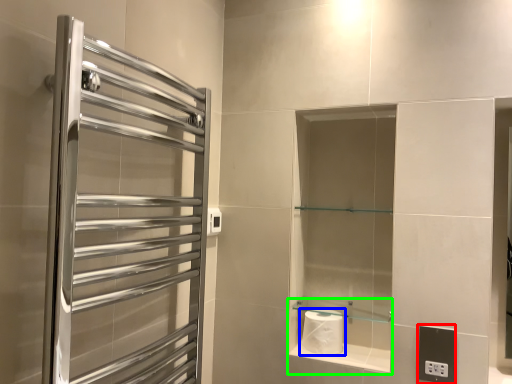
Question: Which object is positioned closest to electric outlet (highlighted by a red box)? Select from toilet paper (highlighted by a blue box) and cabinet (highlighted by a green box).

Choices:
 (A) toilet paper
 (B) cabinet

Answer: (B)